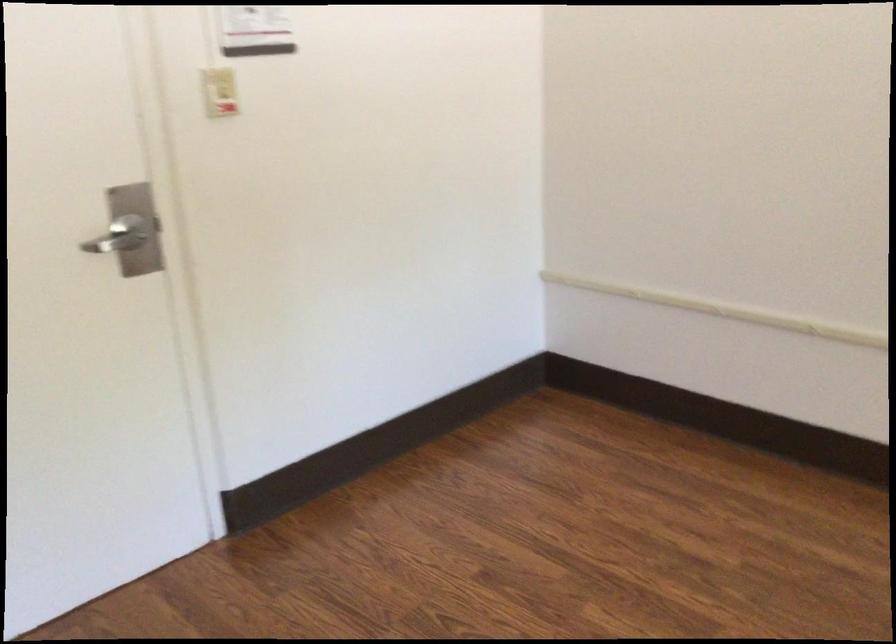
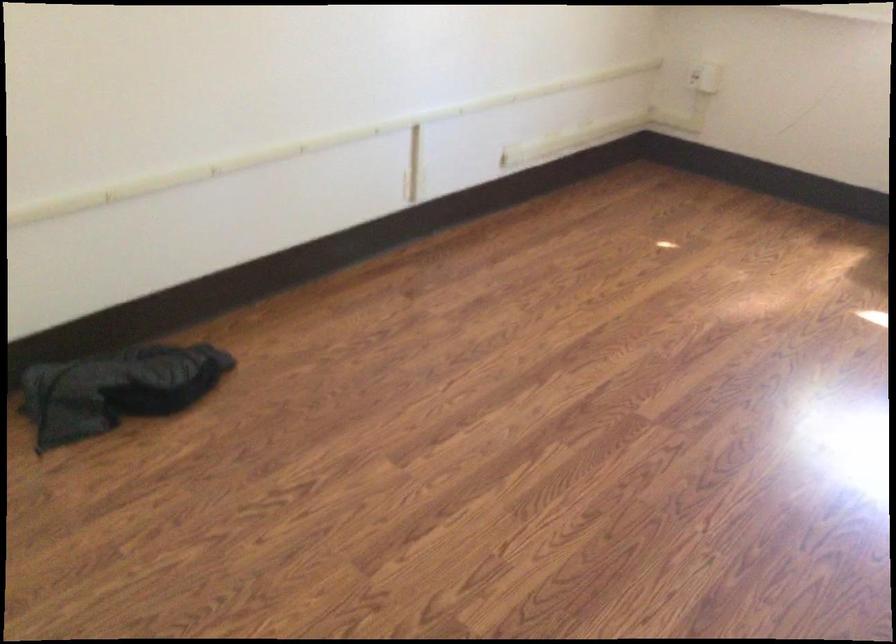
The first image is from the beginning of the video and the second image is from the end. How did the camera likely rotate when shooting the video?

The camera rotated toward right-down.